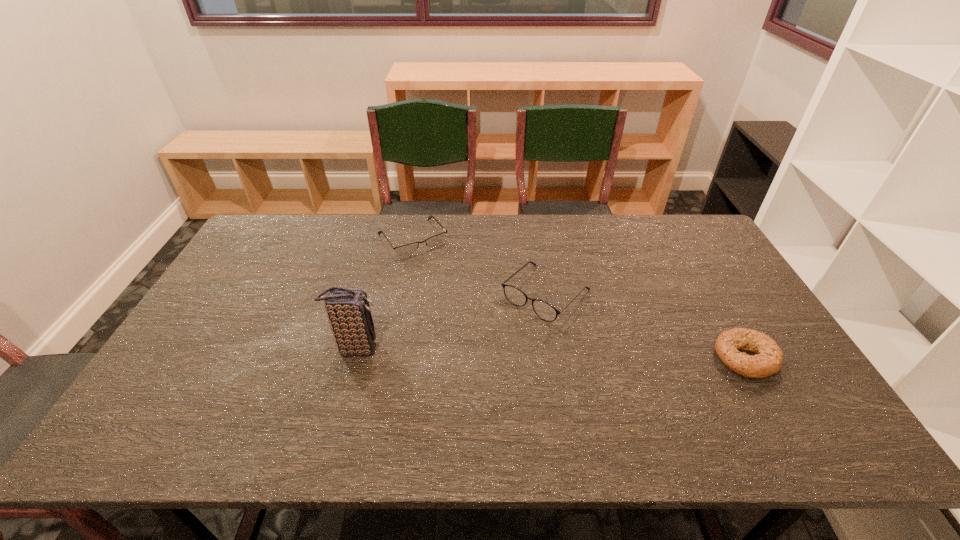
Locate an element on the screen. vacant space on the desktop that is between the tallest object and the rightmost object and is positioned on the front-facing side of the third shortest object is located at coordinates (491, 352).

In order to click on free spot on the desktop that is between the tallest object and the bagel and is positioned on the front-facing side of the left spectacles in this screenshot , I will do `click(501, 352)`.